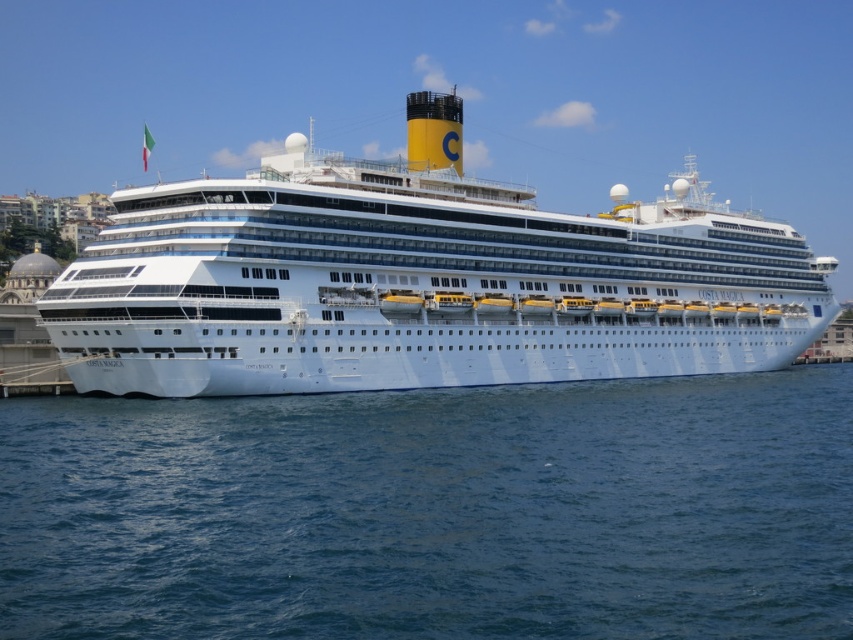
Consider the image. Can you confirm if blue water at lower center is thinner than white glossy cruise ship at center?

Yes.

Who is taller, blue water at lower center or white glossy cruise ship at center?

white glossy cruise ship at center

Is point (233, 445) less distant than point (422, 362)?

Yes, it is.

Where is `blue water at lower center`? blue water at lower center is located at coordinates (434, 513).